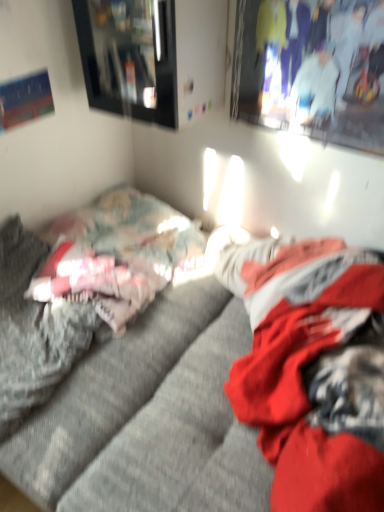
Measure the distance between fluffy gray bed at left and camera.

1.09 meters.

What do you see at coordinates (208, 399) in the screenshot?
I see `textured gray couch at center` at bounding box center [208, 399].

Identify the location of matte black picture frame at upper left. (129, 57).

Does point (301, 19) appear closer or farther from the camera than point (171, 23)?

Point (301, 19) is positioned closer to the camera compared to point (171, 23).

Does matte white couple at upper right touch matte black picture frame at upper left?

No, matte white couple at upper right is not with matte black picture frame at upper left.

Between matte white couple at upper right and matte black picture frame at upper left, which one is positioned in front?

matte white couple at upper right is in front.

Is textured gray couch at center closer to camera compared to fluffy gray bed at left?

Yes, textured gray couch at center is in front of fluffy gray bed at left.

Does textured gray couch at center turn towards fluffy gray bed at left?

No, textured gray couch at center is not aimed at fluffy gray bed at left.

From a real-world perspective, is textured gray couch at center above or below fluffy gray bed at left?

textured gray couch at center is situated higher than fluffy gray bed at left in the real world.

Can you confirm if textured gray couch at center is wider than matte white couple at upper right?

Yes, textured gray couch at center is wider than matte white couple at upper right.

Could you tell me if textured gray couch at center is turned towards matte white couple at upper right?

No, textured gray couch at center is not turned towards matte white couple at upper right.

Relative to matte white couple at upper right, is textured gray couch at center in front or behind?

Visually, textured gray couch at center is located in front of matte white couple at upper right.

Locate an element on the screen. This screenshot has width=384, height=512. picture frame above the matte white couple at upper right (from the image's perspective) is located at coordinates (129, 57).

Is matte black picture frame at upper left positioned with its back to matte white couple at upper right?

No.

Is matte black picture frame at upper left in front of matte white couple at upper right?

No.

Is matte black picture frame at upper left placed right next to matte white couple at upper right?

matte black picture frame at upper left and matte white couple at upper right are not in contact.

Would you consider matte black picture frame at upper left to be distant from textured gray couch at center?

matte black picture frame at upper left is actually quite close to textured gray couch at center.

Is matte black picture frame at upper left facing away from textured gray couch at center?

No, textured gray couch at center is not at the back of matte black picture frame at upper left.

Is matte black picture frame at upper left bigger or smaller than textured gray couch at center?

Clearly, matte black picture frame at upper left is smaller in size than textured gray couch at center.

Can you confirm if matte black picture frame at upper left is positioned to the left of textured gray couch at center?

Correct, you'll find matte black picture frame at upper left to the left of textured gray couch at center.

Is fluffy gray bed at left inside the boundaries of matte black picture frame at upper left, or outside?

fluffy gray bed at left cannot be found inside matte black picture frame at upper left.

Is fluffy gray bed at left looking in the opposite direction of matte black picture frame at upper left?

No, fluffy gray bed at left is not facing away from matte black picture frame at upper left.

Does fluffy gray bed at left have a greater width compared to matte black picture frame at upper left?

Yes, fluffy gray bed at left is wider than matte black picture frame at upper left.

Is fluffy gray bed at left with matte black picture frame at upper left?

No, fluffy gray bed at left is not touching matte black picture frame at upper left.

Image resolution: width=384 pixels, height=512 pixels. In order to click on picture frame positioned vertically above the textured gray couch at center (from a real-world perspective) in this screenshot , I will do `click(129, 57)`.

Does textured gray couch at center appear on the right side of matte black picture frame at upper left?

Indeed, textured gray couch at center is positioned on the right side of matte black picture frame at upper left.

From the image's perspective, which object appears higher, textured gray couch at center or matte black picture frame at upper left?

matte black picture frame at upper left, from the image's perspective.

Considering the points (156, 297) and (95, 44), which point is behind, point (156, 297) or point (95, 44)?

The point (156, 297) is farther.

What are the coordinates of `couple in front of the matte black picture frame at upper left` in the screenshot? It's located at (317, 57).

There is a fluffy gray bed at left. What are the coordinates of `studio couch above it (from a real-world perspective)` in the screenshot? It's located at (208, 399).

Estimate the real-world distances between objects in this image. Which object is further from fluffy gray bed at left, textured gray couch at center or matte black picture frame at upper left?

The object further to fluffy gray bed at left is matte black picture frame at upper left.

Estimate the real-world distances between objects in this image. Which object is further from matte black picture frame at upper left, textured gray couch at center or matte white couple at upper right?

Based on the image, textured gray couch at center appears to be further to matte black picture frame at upper left.

From the image, which object appears to be nearer to textured gray couch at center, matte black picture frame at upper left or matte white couple at upper right?

Based on the image, matte black picture frame at upper left appears to be nearer to textured gray couch at center.

When comparing their distances from matte white couple at upper right, does textured gray couch at center or matte black picture frame at upper left seem further?

Based on the image, textured gray couch at center appears to be further to matte white couple at upper right.

Based on their spatial positions, is fluffy gray bed at left or matte white couple at upper right further from matte black picture frame at upper left?

The object further to matte black picture frame at upper left is fluffy gray bed at left.

Looking at this image, estimate the real-world distances between objects in this image. Which object is closer to fluffy gray bed at left, matte white couple at upper right or matte black picture frame at upper left?

Based on the image, matte black picture frame at upper left appears to be nearer to fluffy gray bed at left.

Which object lies further to the anchor point fluffy gray bed at left, textured gray couch at center or matte white couple at upper right?

matte white couple at upper right is further to fluffy gray bed at left.

Which object lies nearer to the anchor point fluffy gray bed at left, matte white couple at upper right or textured gray couch at center?

Among the two, textured gray couch at center is located nearer to fluffy gray bed at left.

This screenshot has width=384, height=512. What are the coordinates of `couple between matte black picture frame at upper left and textured gray couch at center in the vertical direction` in the screenshot? It's located at (317, 57).

The height and width of the screenshot is (512, 384). Identify the location of studio couch located between fluffy gray bed at left and matte white couple at upper right in the left-right direction. (208, 399).

I want to click on couple between matte black picture frame at upper left and fluffy gray bed at left in the vertical direction, so click(x=317, y=57).

The image size is (384, 512). I want to click on bed between matte black picture frame at upper left and textured gray couch at center from top to bottom, so click(x=86, y=290).